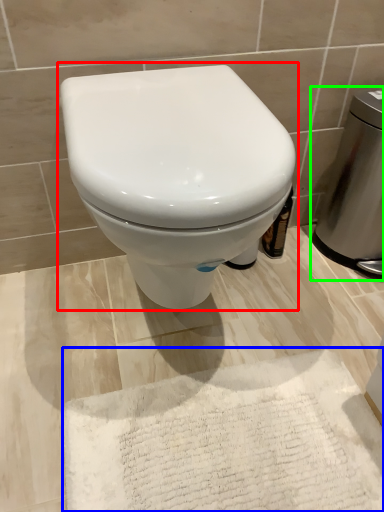
Question: Based on their relative distances, which object is nearer to toilet (highlighted by a red box)? Choose from bath mat (highlighted by a blue box) and appliance (highlighted by a green box).

Choices:
 (A) bath mat
 (B) appliance

Answer: (A)